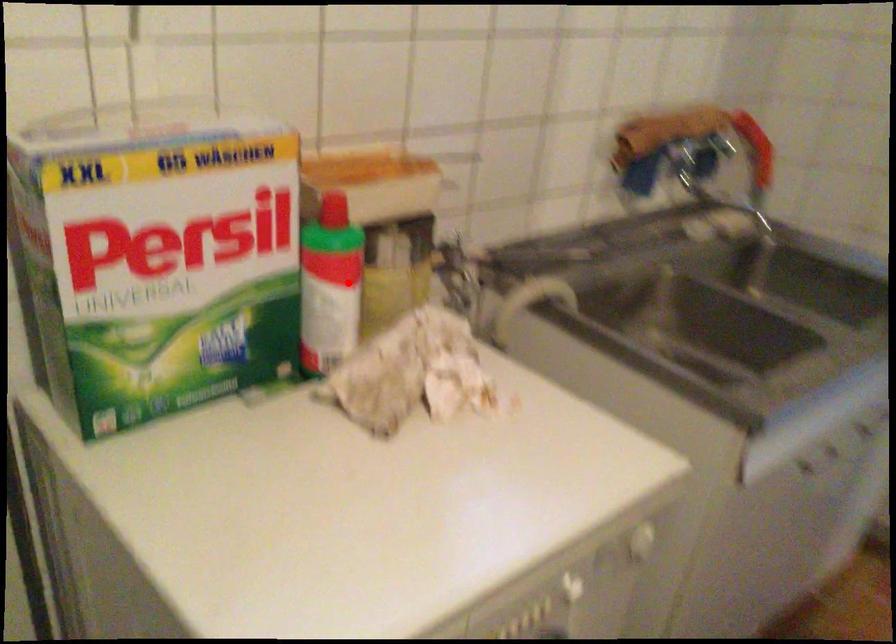
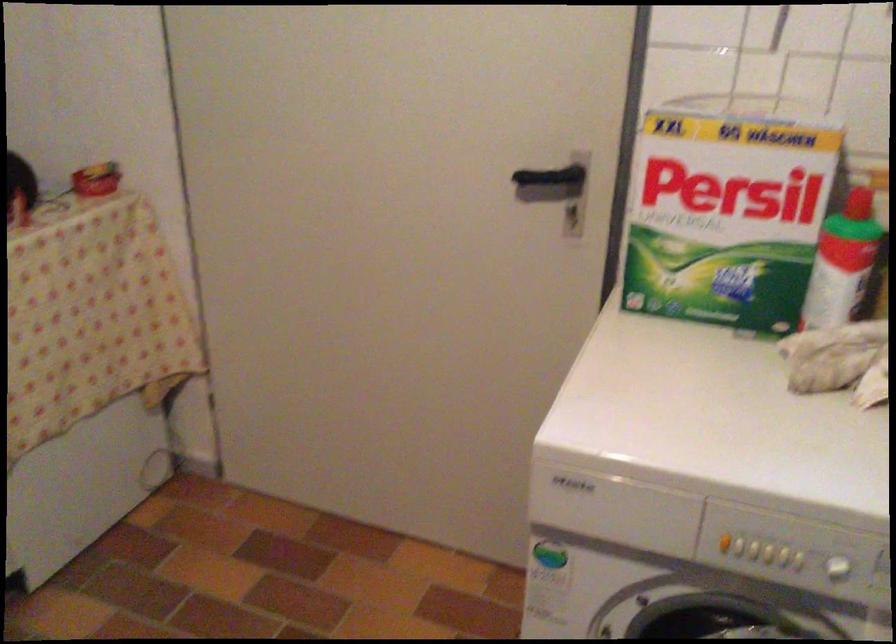
Question: I am providing you with two images of the same scene from different viewpoints. Image1 has a red point marked. In image2, the corresponding 3D location appears at what relative position? Reply with the corresponding letter.

Choices:
 (A) Closer
 (B) Farther

Answer: (B)